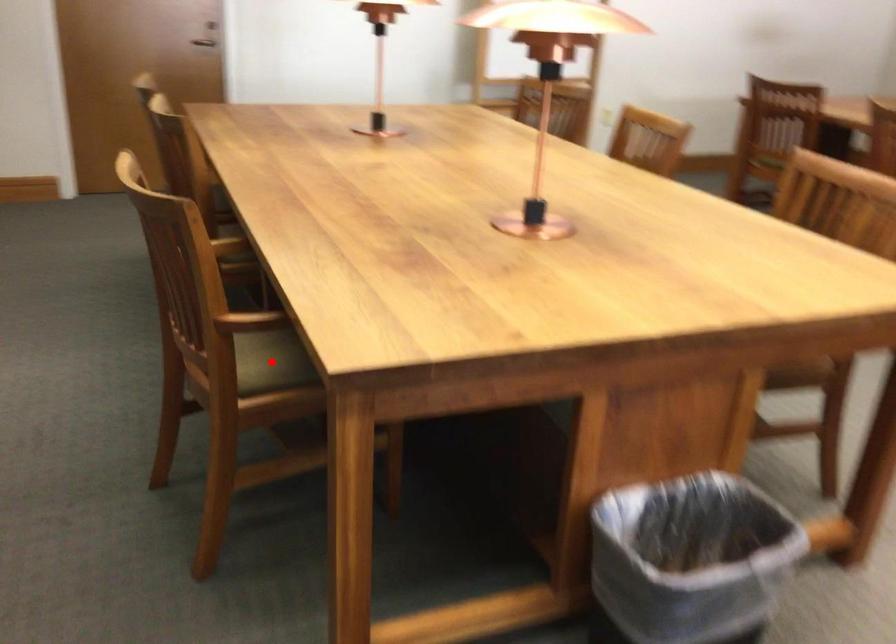
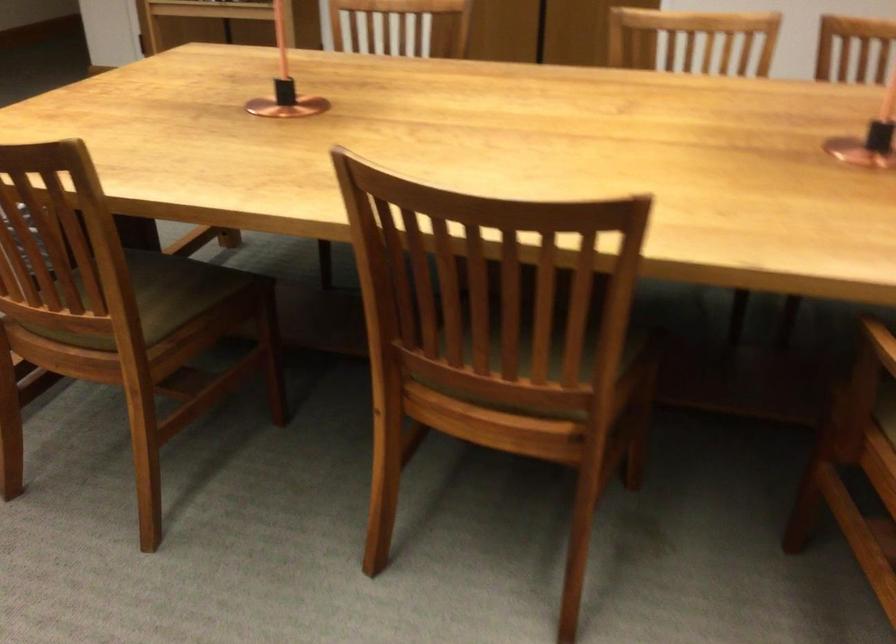
Question: I am providing you with two images of the same scene from different viewpoints. A red point is marked on the first image. At the location where the point appears in image 1, is it still visible in image 2?

Choices:
 (A) Yes
 (B) No

Answer: (B)